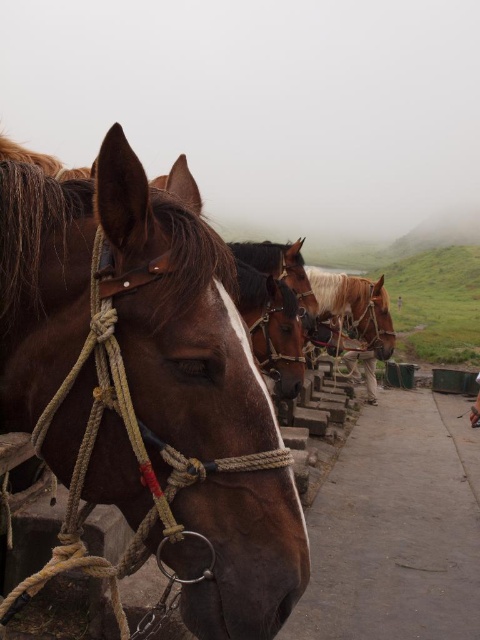
You are standing in the rural area where the horses are tied up. You need to locate the brown glossy horse at center. According to the coordinates given, where exactly is it positioned?

The brown glossy horse at center is located at the 2D coordinates point (272,326).

You are standing at the origin point of the image coordinate system. You need to locate the brown leather rope at left. Which direction should you move to reach it?

The brown leather rope at left is located at coordinate point 0.600 on the x axis and 0.310 on the y axis. Since you are at the origin point, you need to move right along the x axis to 0.600 and up along the y axis to 0.310 to reach it.